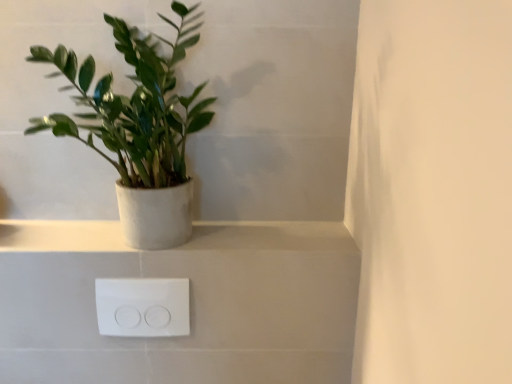
Question: Does green matte plant at left have a greater width compared to white plastic outlet at lower center?

Choices:
 (A) no
 (B) yes

Answer: (B)

Question: From a real-world perspective, does green matte plant at left stand above white plastic outlet at lower center?

Choices:
 (A) yes
 (B) no

Answer: (A)

Question: Does green matte plant at left have a smaller size compared to white plastic outlet at lower center?

Choices:
 (A) no
 (B) yes

Answer: (A)

Question: Is green matte plant at left turned away from white plastic outlet at lower center?

Choices:
 (A) yes
 (B) no

Answer: (B)

Question: From the image's perspective, does green matte plant at left appear lower than white plastic outlet at lower center?

Choices:
 (A) yes
 (B) no

Answer: (B)

Question: Does green matte plant at left have a larger size compared to white plastic outlet at lower center?

Choices:
 (A) yes
 (B) no

Answer: (A)

Question: Would you say white plastic outlet at lower center is outside white matte/porcelain shelf at upper center?

Choices:
 (A) no
 (B) yes

Answer: (B)

Question: Is white plastic outlet at lower center shorter than white matte/porcelain shelf at upper center?

Choices:
 (A) yes
 (B) no

Answer: (B)

Question: Considering the relative sizes of white plastic outlet at lower center and white matte/porcelain shelf at upper center in the image provided, is white plastic outlet at lower center smaller than white matte/porcelain shelf at upper center?

Choices:
 (A) yes
 (B) no

Answer: (A)

Question: Is white plastic outlet at lower center facing away from white matte/porcelain shelf at upper center?

Choices:
 (A) yes
 (B) no

Answer: (B)

Question: Can you confirm if white plastic outlet at lower center is wider than white matte/porcelain shelf at upper center?

Choices:
 (A) no
 (B) yes

Answer: (A)

Question: Does white plastic outlet at lower center have a greater height compared to white matte/porcelain shelf at upper center?

Choices:
 (A) yes
 (B) no

Answer: (A)

Question: From the image's perspective, does white matte/porcelain shelf at upper center appear higher than green matte plant at left?

Choices:
 (A) yes
 (B) no

Answer: (B)